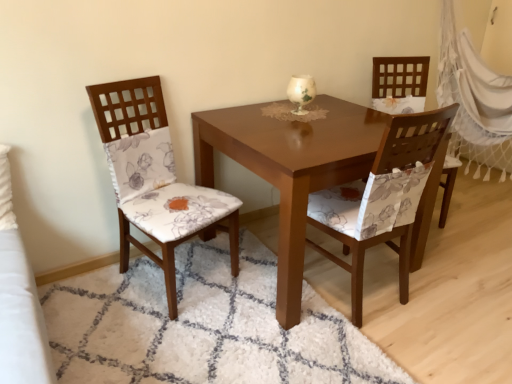
Where is `vacant space that is to the left of wooden chair with floral cushion at left, which is counted as the third chair, starting from the right`? Image resolution: width=512 pixels, height=384 pixels. vacant space that is to the left of wooden chair with floral cushion at left, which is counted as the third chair, starting from the right is located at coordinates (88, 292).